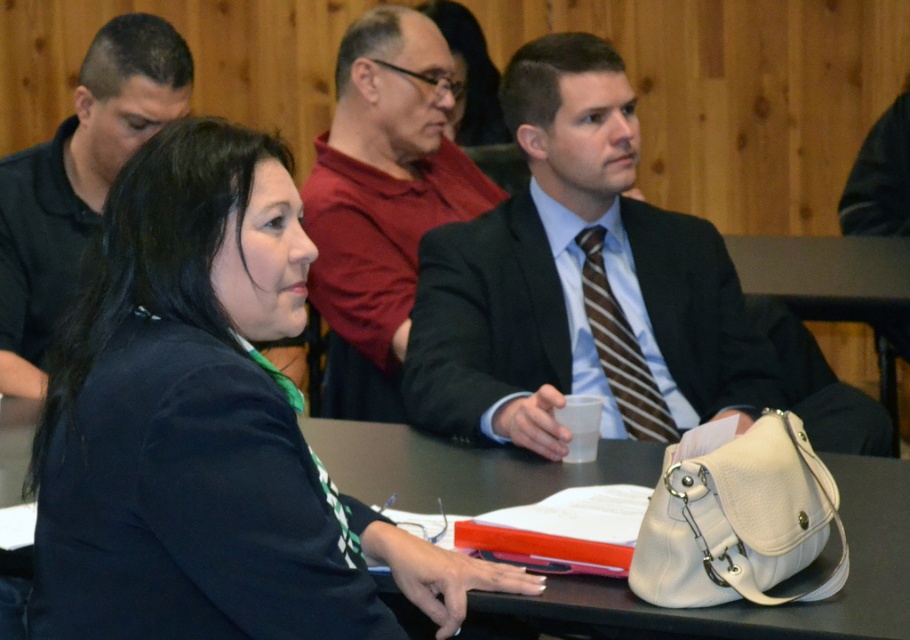
Question: Where is black fabric jacket at center located in relation to matte black suit at center in the image?

Choices:
 (A) right
 (B) left

Answer: (B)

Question: Among these points, which one is nearest to the camera?

Choices:
 (A) (165, 129)
 (B) (624, 184)

Answer: (A)

Question: Which is nearer to the black matte blazer at center?

Choices:
 (A) matte black suit at center
 (B) matte red shirt at center
 (C) white leather handbag at lower center

Answer: (C)

Question: Based on their relative distances, which object is nearer to the matte black suit at center?

Choices:
 (A) brown striped tie at center
 (B) black matte blazer at center
 (C) black matte shirt at left
 (D) white leather handbag at lower center

Answer: (A)

Question: Does black fabric jacket at center appear over black matte shirt at left?

Choices:
 (A) yes
 (B) no

Answer: (B)

Question: Is black matte blazer at center smaller than brown striped tie at center?

Choices:
 (A) yes
 (B) no

Answer: (B)